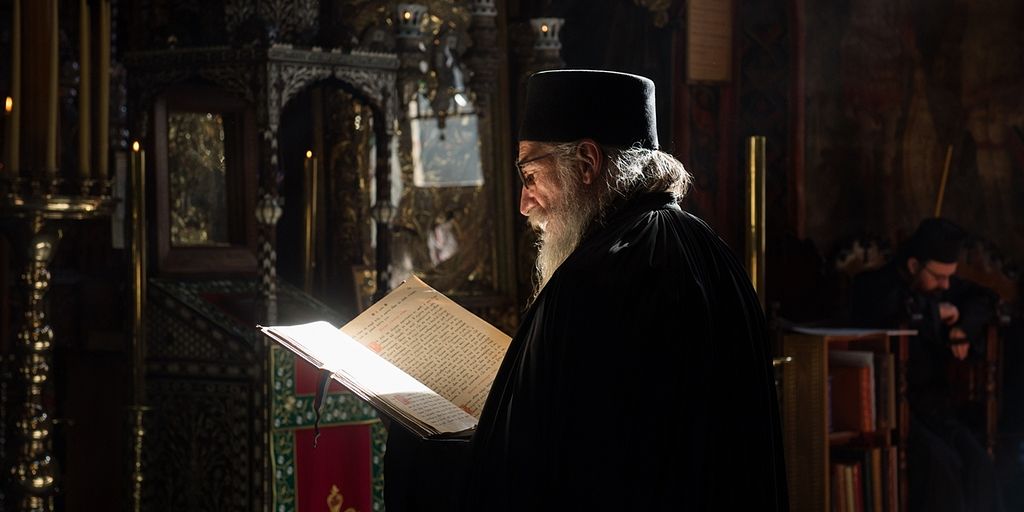
At what (x,y) coordinates should I click in order to perform the action: click on wall. Please return your answer as a coordinate pair (x, y). Looking at the image, I should click on (887, 158).